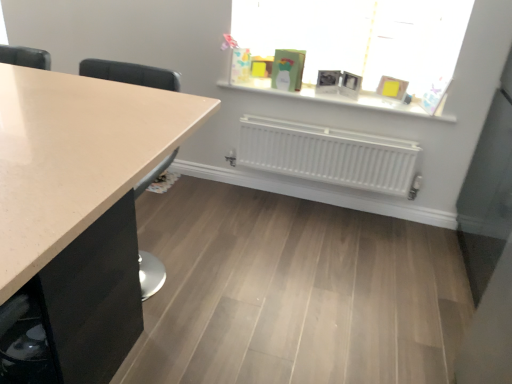
Question: Relative to white matte radiator at center, is matte glass window at upper center in front or behind?

Choices:
 (A) behind
 (B) front

Answer: (B)

Question: From a real-world perspective, is matte glass window at upper center physically located above or below white matte radiator at center?

Choices:
 (A) above
 (B) below

Answer: (A)

Question: Which object is positioned farthest from the matte beige countertop at left?

Choices:
 (A) white matte window sill at upper center
 (B) matte glass window at upper center
 (C) white matte radiator at center

Answer: (A)

Question: Which of these objects is positioned farthest from the white matte window sill at upper center?

Choices:
 (A) white matte radiator at center
 (B) matte glass window at upper center
 (C) matte beige countertop at left

Answer: (C)